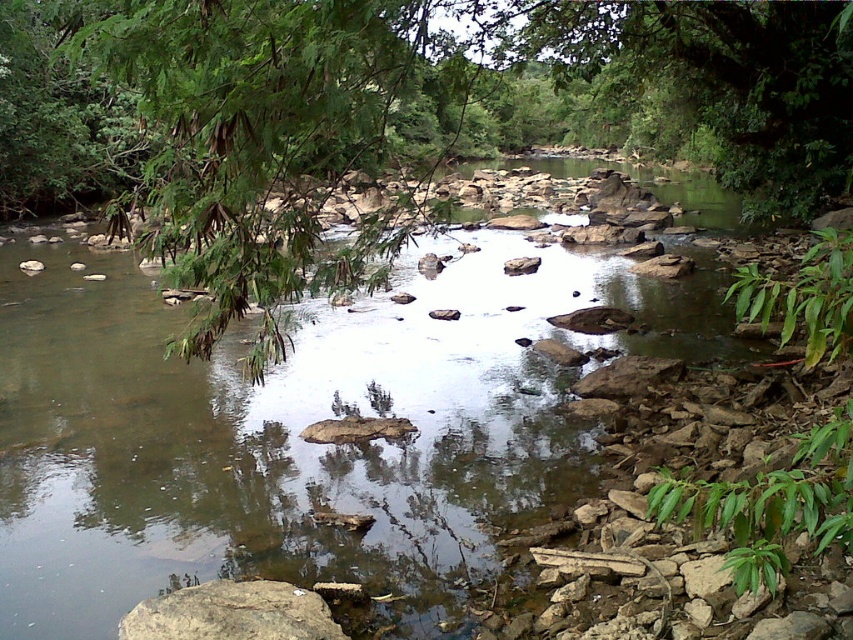
You are standing at the edge of a serene natural scene with a shallow river. You want to cross to the other side using the brown rocky stream at center. Given that the stream is 14.84 feet away from where you are standing, can you safely walk across it without getting your shoes wet?

The brown rocky stream at center is 14.84 feet away from the camera. Since the stream is part of the riverbed and the water appears shallow with visible rocks, you can safely walk across the brown rocky stream at center as long as you step carefully on the rocks to avoid getting your shoes wet.

You are standing at the origin point of the image coordinate system. Where is the brown rocky stream at center located in terms of its 2D coordinates?

The brown rocky stream at center is located at the 2D coordinates of point (299, 429).

You are standing at the edge of the river and want to place a small pebble on the brown rough rock at lower left. Can you see the brown rocky stream at center from the pebble? Explain why.

Yes, because the brown rocky stream at center is closer to you than the brown rough rock at lower left, so the stream would be visible from the pebble.